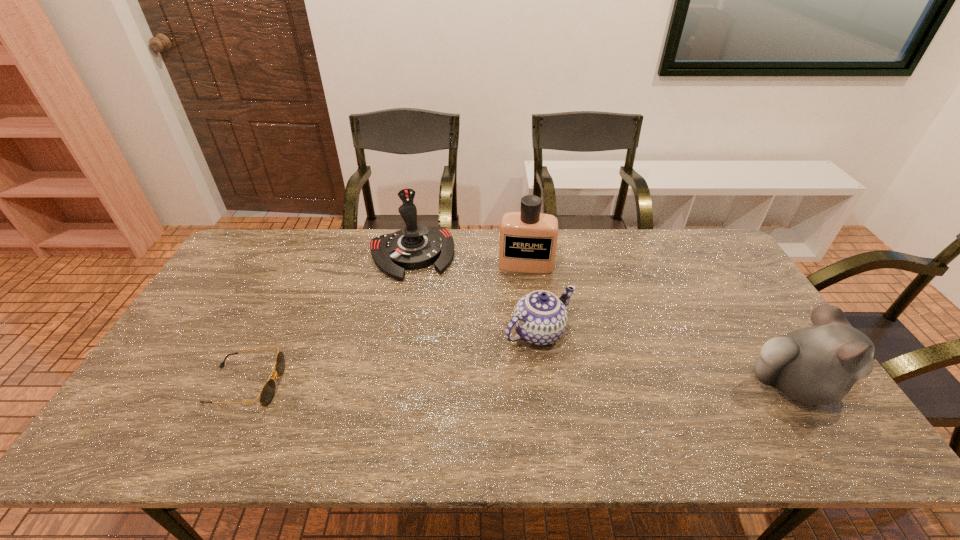
Locate an element on the screen. Image resolution: width=960 pixels, height=540 pixels. vacant spot on the desktop that is between the sunglasses and the rightmost object and is positioned on the front label of the perfume is located at coordinates (520, 385).

Where is `free space on the desktop that is between the leftmost object and the hamster and is positioned at the spout of the chinaware`? The image size is (960, 540). free space on the desktop that is between the leftmost object and the hamster and is positioned at the spout of the chinaware is located at coordinates (593, 385).

In order to click on free spot on the desktop that is between the leftmost object and the rightmost object and is positioned on the handle side of the second object from left to right in this screenshot , I will do `click(447, 385)`.